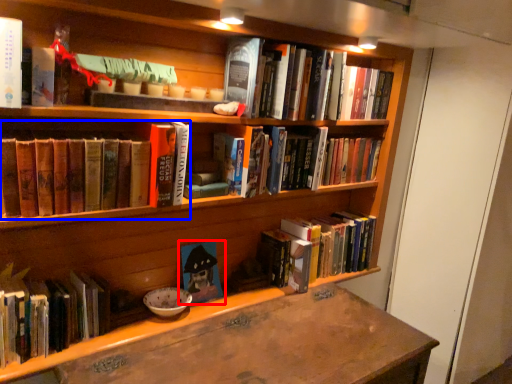
Question: Among these objects, which one is farthest to the camera, book (highlighted by a red box) or book (highlighted by a blue box)?

Choices:
 (A) book
 (B) book

Answer: (A)